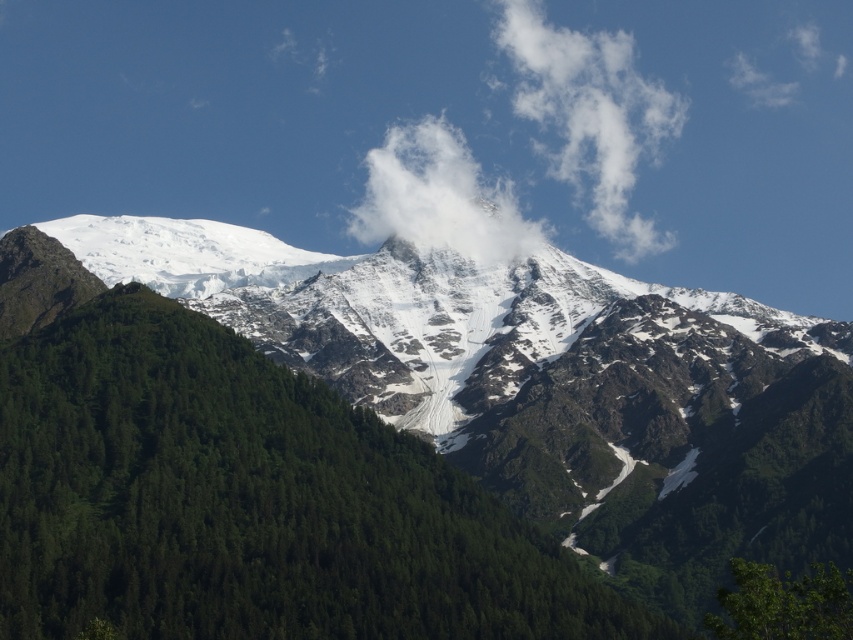
Question: In this image, where is white snow at left located relative to green leafy tree at lower right?

Choices:
 (A) above
 (B) below

Answer: (A)

Question: Which point is closer to the camera?

Choices:
 (A) (606, 163)
 (B) (502, 248)
 (C) (756, 636)

Answer: (C)

Question: Which object appears closest to the camera in this image?

Choices:
 (A) white snow at left
 (B) white fluffy cloud at upper center

Answer: (A)

Question: Among these objects, which one is farthest from the camera?

Choices:
 (A) green leafy tree at lower right
 (B) white snow at left

Answer: (B)

Question: Does green matte tree at center appear on the left side of white fluffy cloud at center?

Choices:
 (A) yes
 (B) no

Answer: (A)

Question: Does white fluffy cloud at center appear on the left side of green leafy tree at lower right?

Choices:
 (A) yes
 (B) no

Answer: (A)